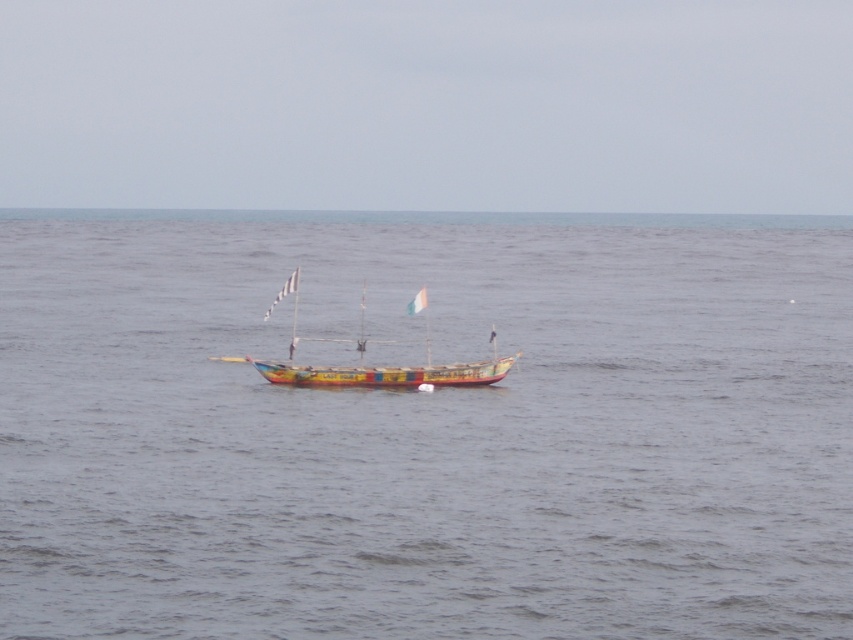
Does smooth gray water at center appear on the left side of painted wooden boat at center?

Incorrect, smooth gray water at center is not on the left side of painted wooden boat at center.

Which is in front, point (337, 397) or point (422, 380)?

Positioned in front is point (337, 397).

This screenshot has height=640, width=853. Identify the location of smooth gray water at center. (426, 428).